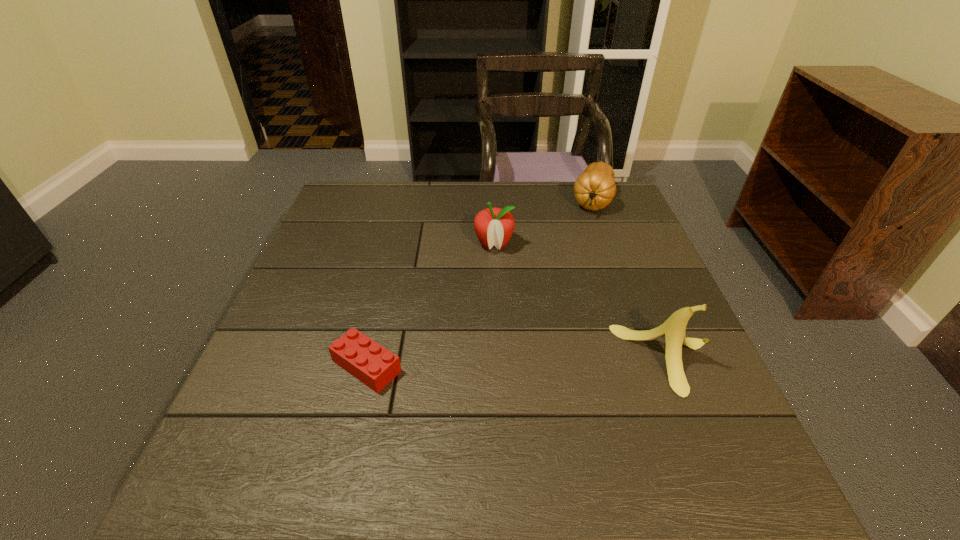
This screenshot has height=540, width=960. What are the coordinates of `free space that is in between the farthest object and the third object from right to left` in the screenshot? It's located at (543, 222).

You are a GUI agent. You are given a task and a screenshot of the screen. Output one action in this format:
    pyautogui.click(x=<x>, y=<y>)
    Task: Click on the free spot between the Lego and the third object from right to left
    The image size is (960, 540).
    Given the screenshot: What is the action you would take?
    pyautogui.click(x=430, y=305)

Where is `free space between the banana and the apple`? free space between the banana and the apple is located at coordinates (581, 302).

In order to click on empty space between the banana and the Lego in this screenshot , I will do `click(517, 362)`.

What are the coordinates of `object that is the second closest to the shortest object` in the screenshot? It's located at (673, 329).

Identify the location of object that is the third closest one to the banana. The image size is (960, 540). (369, 362).

The height and width of the screenshot is (540, 960). In order to click on vacant space that satisfies the following two spatial constraints: 1. on the back side of the gourd; 2. on the right side of the shortest object in this screenshot , I will do `click(406, 200)`.

You are a GUI agent. You are given a task and a screenshot of the screen. Output one action in this format:
    pyautogui.click(x=<x>, y=<y>)
    Task: Click on the vacant region that satisfies the following two spatial constraints: 1. on the front side of the banana; 2. on the right side of the third nearest object
    This screenshot has height=540, width=960.
    Given the screenshot: What is the action you would take?
    pos(498,359)